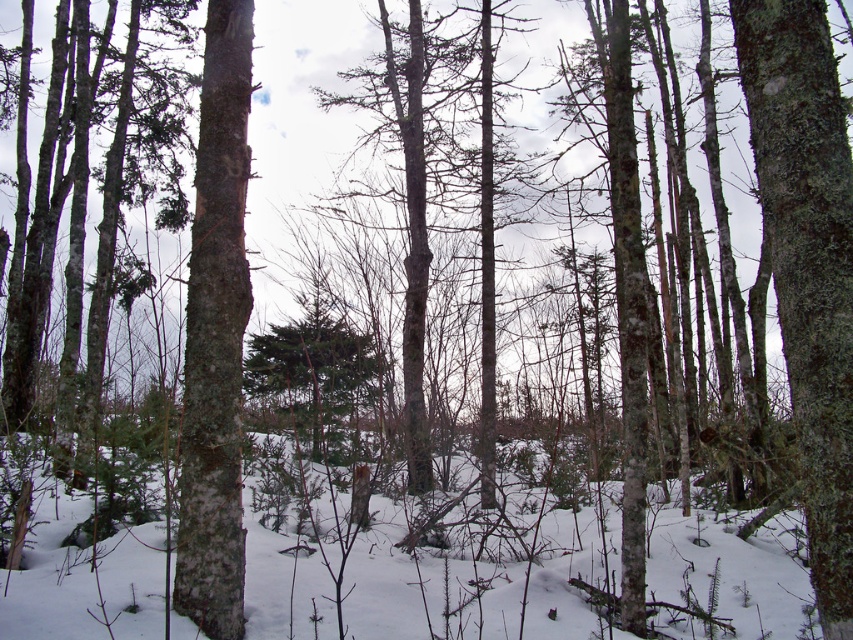
You are an environmental scientist assessing the health of trees in a winter forest. You observe the smooth bark tree at center and the smooth white bark at center. Which tree has a narrower trunk?

The smooth bark tree at center has a narrower trunk than the smooth white bark at center because the smooth bark tree at center is less in width.

You are standing in the middle of the wintry forest scene. There is a point marked at coordinates point (476,580). What is located at that point?

The point (476,580) marks white powdery snow at center.

From the picture: You are standing in the middle of a wintry forest and want to take a step forward. Where should you step to avoid stepping on the white powdery snow at center?

You should step anywhere except the white powdery snow at center, which is located at point [476,580]. Since the snow is at the center, stepping to the sides or slightly forward but away from that point would avoid it.